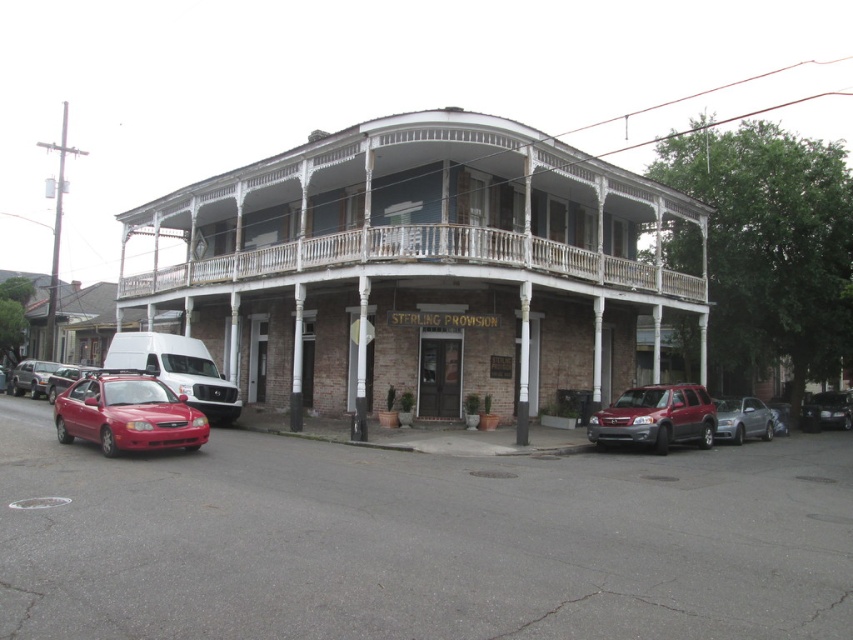
Does shiny red sedan at lower left have a lesser width compared to satin red suv at lower right?

Yes, shiny red sedan at lower left is thinner than satin red suv at lower right.

Where is `shiny red sedan at lower left`? shiny red sedan at lower left is located at coordinates (126, 413).

I want to click on shiny red sedan at lower left, so click(126, 413).

Is shiny red sedan at lower left shorter than metallic silver sedan at left?

Correct, shiny red sedan at lower left is not as tall as metallic silver sedan at left.

Is shiny red sedan at lower left closer to camera compared to metallic silver sedan at left?

Yes.

Which is behind, point (125, 390) or point (33, 362)?

Point (33, 362)

Locate an element on the screen. This screenshot has width=853, height=640. shiny red sedan at lower left is located at coordinates (126, 413).

Does satin silver sedan at center have a greater width compared to matte red sedan at lower left?

Incorrect, satin silver sedan at center's width does not surpass matte red sedan at lower left's.

Does satin silver sedan at center appear on the right side of matte red sedan at lower left?

Indeed, satin silver sedan at center is positioned on the right side of matte red sedan at lower left.

What do you see at coordinates (741, 419) in the screenshot? The width and height of the screenshot is (853, 640). I see `satin silver sedan at center` at bounding box center [741, 419].

At what (x,y) coordinates should I click in order to perform the action: click on satin silver sedan at center. Please return your answer as a coordinate pair (x, y). This screenshot has width=853, height=640. Looking at the image, I should click on (741, 419).